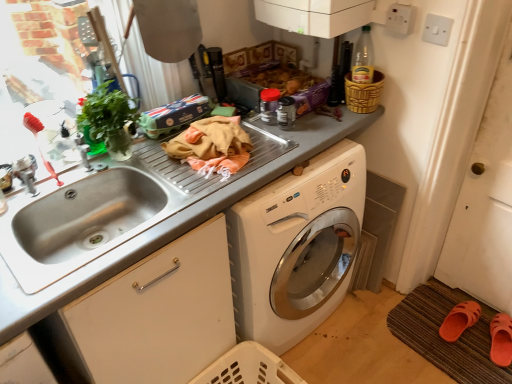
Question: From the image's perspective, is brown woven mat at lower right located above green leafy plant at left?

Choices:
 (A) yes
 (B) no

Answer: (B)

Question: Considering the relative sizes of brown woven mat at lower right and green leafy plant at left in the image provided, is brown woven mat at lower right shorter than green leafy plant at left?

Choices:
 (A) yes
 (B) no

Answer: (A)

Question: Is brown woven mat at lower right positioned behind green leafy plant at left?

Choices:
 (A) yes
 (B) no

Answer: (A)

Question: Can you confirm if brown woven mat at lower right is positioned to the left of green leafy plant at left?

Choices:
 (A) no
 (B) yes

Answer: (A)

Question: Is the depth of brown woven mat at lower right less than that of green leafy plant at left?

Choices:
 (A) no
 (B) yes

Answer: (A)

Question: From a real-world perspective, is bamboo textured basket at upper right physically located above or below white plastic electric outlet at upper right, acting as the 1th electric outlet starting from the left?

Choices:
 (A) below
 (B) above

Answer: (A)

Question: Considering the relative positions of bamboo textured basket at upper right and white plastic electric outlet at upper right, acting as the 1th electric outlet starting from the left, in the image provided, is bamboo textured basket at upper right to the left or to the right of white plastic electric outlet at upper right, acting as the 1th electric outlet starting from the left,?

Choices:
 (A) left
 (B) right

Answer: (A)

Question: Looking at the image, does bamboo textured basket at upper right seem bigger or smaller compared to white plastic electric outlet at upper right, acting as the 1th electric outlet starting from the left?

Choices:
 (A) big
 (B) small

Answer: (A)

Question: In terms of width, does bamboo textured basket at upper right look wider or thinner when compared to white plastic electric outlet at upper right, marked as the second electric outlet in a right-to-left arrangement?

Choices:
 (A) thin
 (B) wide

Answer: (B)

Question: Is stainless steel sink at left in front of or behind bamboo textured basket at upper right in the image?

Choices:
 (A) behind
 (B) front

Answer: (B)

Question: From a real-world perspective, relative to bamboo textured basket at upper right, is stainless steel sink at left vertically above or below?

Choices:
 (A) below
 (B) above

Answer: (A)

Question: Considering the positions of stainless steel sink at left and bamboo textured basket at upper right in the image, is stainless steel sink at left wider or thinner than bamboo textured basket at upper right?

Choices:
 (A) wide
 (B) thin

Answer: (A)

Question: Is point (10, 205) positioned closer to the camera than point (373, 102)?

Choices:
 (A) closer
 (B) farther

Answer: (A)

Question: Would you say white matte screen door at right is to the left or to the right of gray matte countertop at center in the picture?

Choices:
 (A) right
 (B) left

Answer: (A)

Question: Do you think white matte screen door at right is within gray matte countertop at center, or outside of it?

Choices:
 (A) inside
 (B) outside

Answer: (B)